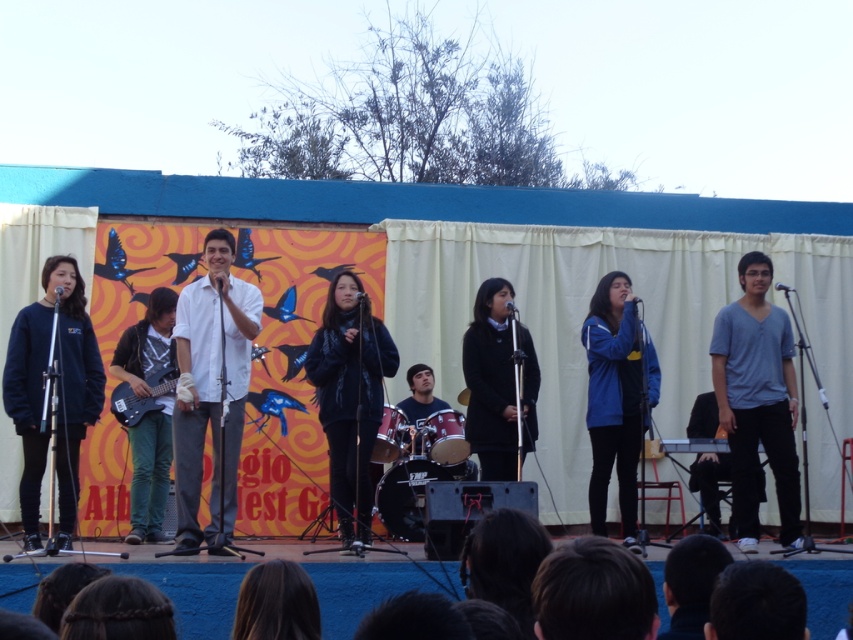
Based on the photo, who is positioned more to the left, dark blue sweatshirt at left or matte black guitar at center?

dark blue sweatshirt at left

This screenshot has width=853, height=640. Identify the location of dark blue sweatshirt at left. [x=57, y=390].

Is point (51, 316) positioned after point (155, 396)?

No, it is in front of (155, 396).

Image resolution: width=853 pixels, height=640 pixels. I want to click on dark blue sweatshirt at left, so click(57, 390).

Who is taller, dark blue sweatshirt at left or black matte guitar at center?

dark blue sweatshirt at left

Is point (74, 364) closer to viewer compared to point (142, 520)?

That is True.

I want to click on dark blue sweatshirt at left, so (57, 390).

Which is more to the right, blue fabric jacket at center or matte black guitar at center?

blue fabric jacket at center is more to the right.

Does blue fabric jacket at center lie behind matte black guitar at center?

No.

Is point (589, 483) positioned in front of point (171, 374)?

No, (589, 483) is behind (171, 374).

Locate an element on the screen. blue fabric jacket at center is located at coordinates (614, 397).